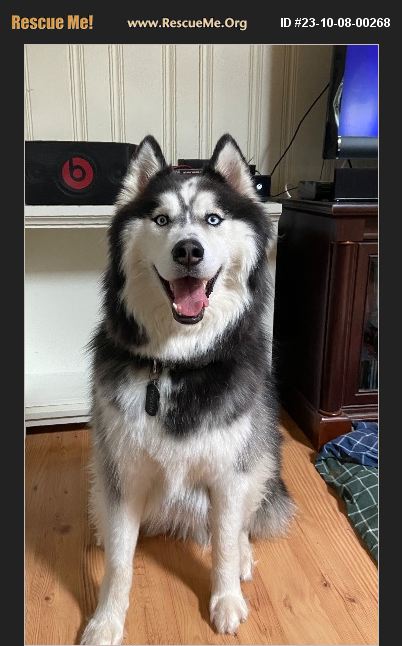
In order to click on white fur in this screenshot , I will do `click(227, 443)`.